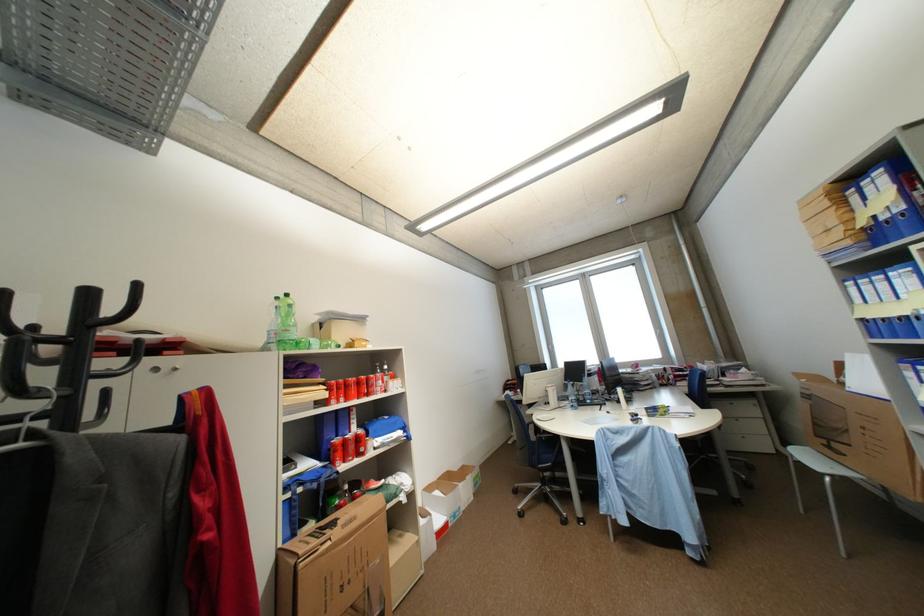
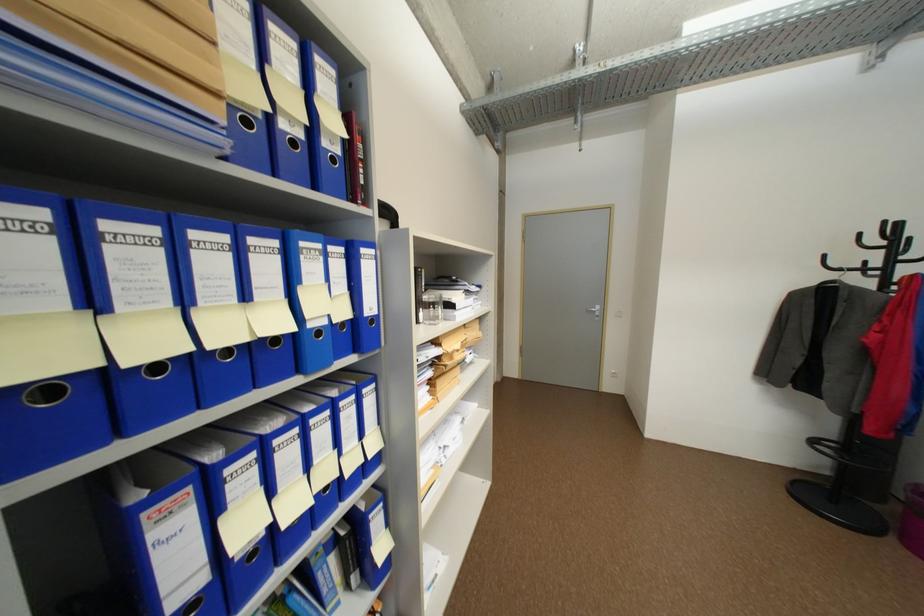
Question: I am providing you with two images of the same scene from different viewpoints. After the viewpoint changes to image2, which objects are now occluded?

Choices:
 (A) binder finger hole
 (B) drinking glass
 (C) black coat hook
 (D) none of these

Answer: (D)